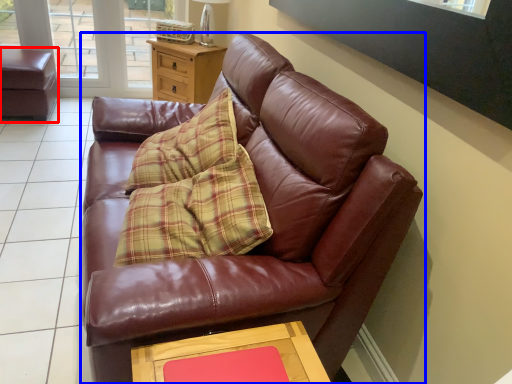
Question: Which point is closer to the camera, swivel chair (highlighted by a red box) or studio couch (highlighted by a blue box)?

Choices:
 (A) swivel chair
 (B) studio couch

Answer: (B)